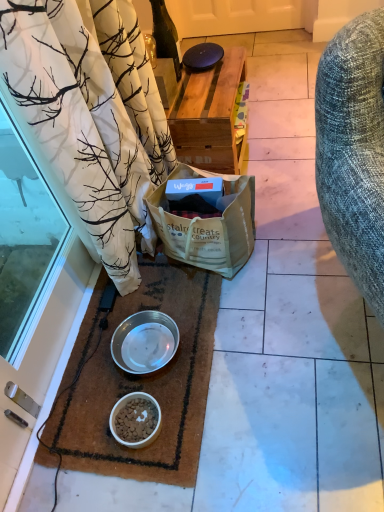
The width and height of the screenshot is (384, 512). What are the coordinates of `vacant area that lies to the right of metallic silver bowl at lower center, acting as the 2th bowl starting from the bottom` in the screenshot? It's located at (197, 330).